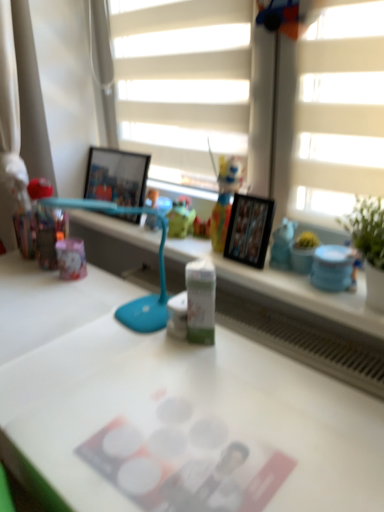
I want to click on free space to the left of teal plastic table lamp at center, so click(47, 324).